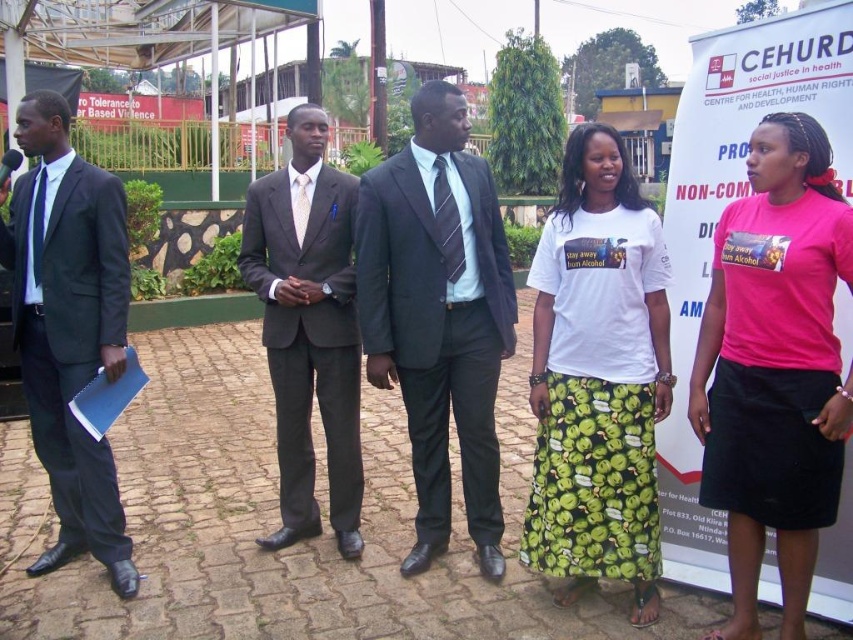
Describe the element at coordinates (775, 368) in the screenshot. The image size is (853, 640). I see `pink fabric skirt at lower right` at that location.

What are the coordinates of `pink fabric skirt at lower right` in the screenshot? It's located at (775, 368).

Who is positioned more to the right, pink fabric skirt at lower right or matte black suit at left?

pink fabric skirt at lower right is more to the right.

Which is below, pink fabric skirt at lower right or matte black suit at left?

pink fabric skirt at lower right

Image resolution: width=853 pixels, height=640 pixels. In order to click on pink fabric skirt at lower right in this screenshot , I will do `click(775, 368)`.

Between pink fabric skirt at lower right and matte gray suit at center, which one appears on the right side from the viewer's perspective?

pink fabric skirt at lower right is more to the right.

Which is more to the left, pink fabric skirt at lower right or matte gray suit at center?

From the viewer's perspective, matte gray suit at center appears more on the left side.

Measure the distance between point (755,417) and camera.

Point (755,417) and camera are 9.61 feet apart from each other.

The width and height of the screenshot is (853, 640). Find the location of `pink fabric skirt at lower right`. pink fabric skirt at lower right is located at coordinates (775, 368).